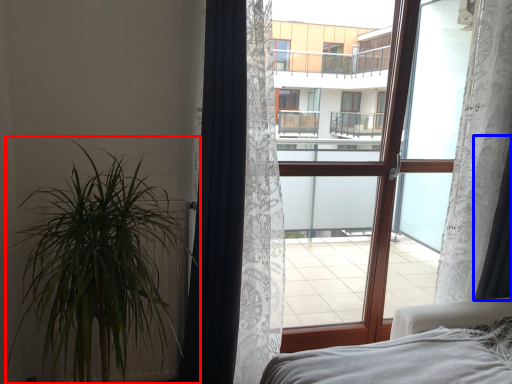
Question: Among these objects, which one is farthest to the camera, houseplant (highlighted by a red box) or curtain (highlighted by a blue box)?

Choices:
 (A) houseplant
 (B) curtain

Answer: (B)